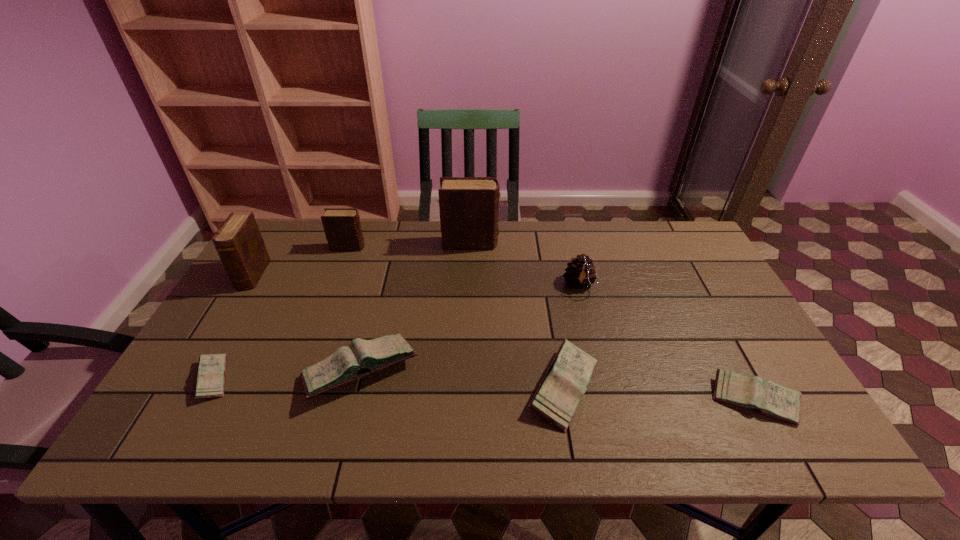
Where is `free space that satisfies the following two spatial constraints: 1. with a leaf charm attached to the rightmost diary; 2. on the right side of the pinecone`? free space that satisfies the following two spatial constraints: 1. with a leaf charm attached to the rightmost diary; 2. on the right side of the pinecone is located at coordinates (608, 400).

You are a GUI agent. You are given a task and a screenshot of the screen. Output one action in this format:
    pyautogui.click(x=<x>, y=<y>)
    Task: Click on the vacant region that satisfies the following two spatial constraints: 1. with a leaf charm attached to the fourth tallest object; 2. on the right side of the rightmost pink diary
    
    Given the screenshot: What is the action you would take?
    pyautogui.click(x=608, y=400)

Where is `vacant point that satisfies the following two spatial constraints: 1. on the spine side of the tallest diary; 2. on the spine side of the second tallest object`? This screenshot has height=540, width=960. vacant point that satisfies the following two spatial constraints: 1. on the spine side of the tallest diary; 2. on the spine side of the second tallest object is located at coordinates (470, 275).

I want to click on free space in the image that satisfies the following two spatial constraints: 1. on the back side of the sixth tallest diary; 2. on the spine side of the smallest brown diary, so click(671, 247).